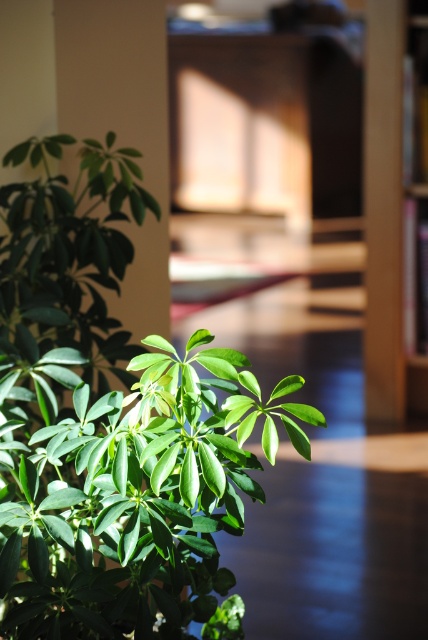
You are arranging a living room and want to place a new piece of furniture. You have the green leafy plant at lower left and the brown wooden bookshelf at right. Which object is wider?

The green leafy plant at lower left is wider than the brown wooden bookshelf at right according to the description.

You are arranging a new potted plant in your living room. You have the green leafy plant at lower left and the brown wooden bookshelf at right. Which object takes up more space in the room?

The green leafy plant at lower left has a larger size compared to the brown wooden bookshelf at right, so it takes up more space in the room.